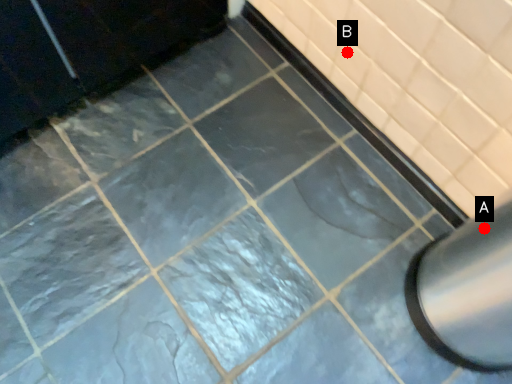
Question: Two points are circled on the image, labeled by A and B beside each circle. Which of the following is the farthest from the observer?

Choices:
 (A) A is further
 (B) B is further

Answer: (B)